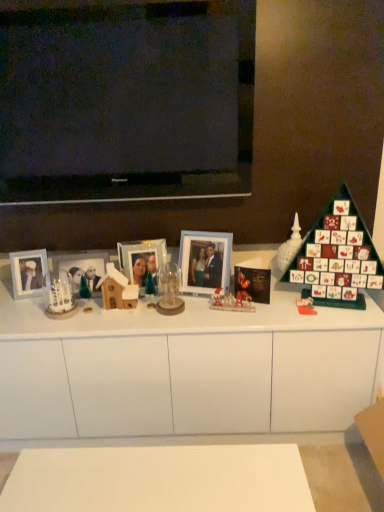
This screenshot has width=384, height=512. In order to click on free spot in front of metallic silver picture frame at center, the third picture frame from the left in this screenshot , I will do `click(138, 318)`.